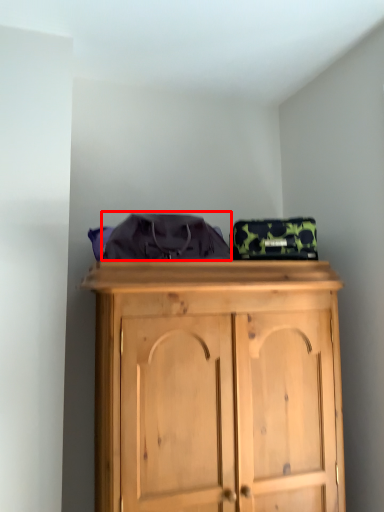
Question: From the image, what is the correct spatial relationship of clothing (annotated by the red box) in relation to bag?

Choices:
 (A) right
 (B) left

Answer: (B)